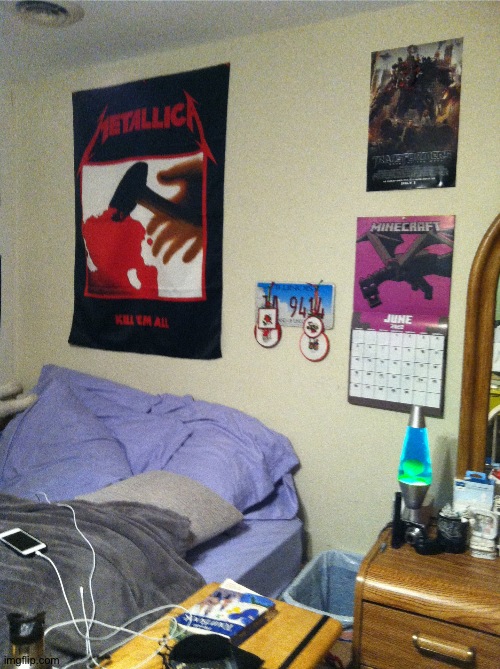
Where is `cords`? Image resolution: width=500 pixels, height=669 pixels. cords is located at coordinates (79, 595).